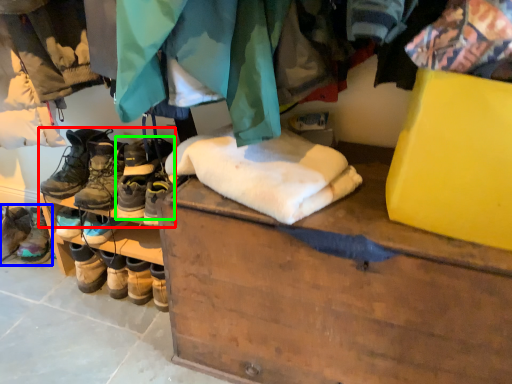
Question: Based on their relative distances, which object is farther from footwear (highlighted by a red box)? Choose from footwear (highlighted by a blue box) and footwear (highlighted by a green box).

Choices:
 (A) footwear
 (B) footwear

Answer: (A)